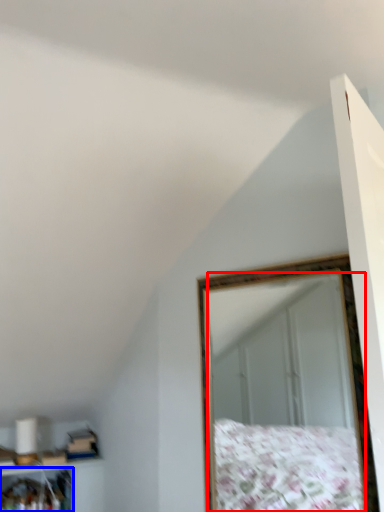
Question: Which of the following is the farthest to the observer, mirror (highlighted by a red box) or cabinet (highlighted by a blue box)?

Choices:
 (A) mirror
 (B) cabinet

Answer: (B)